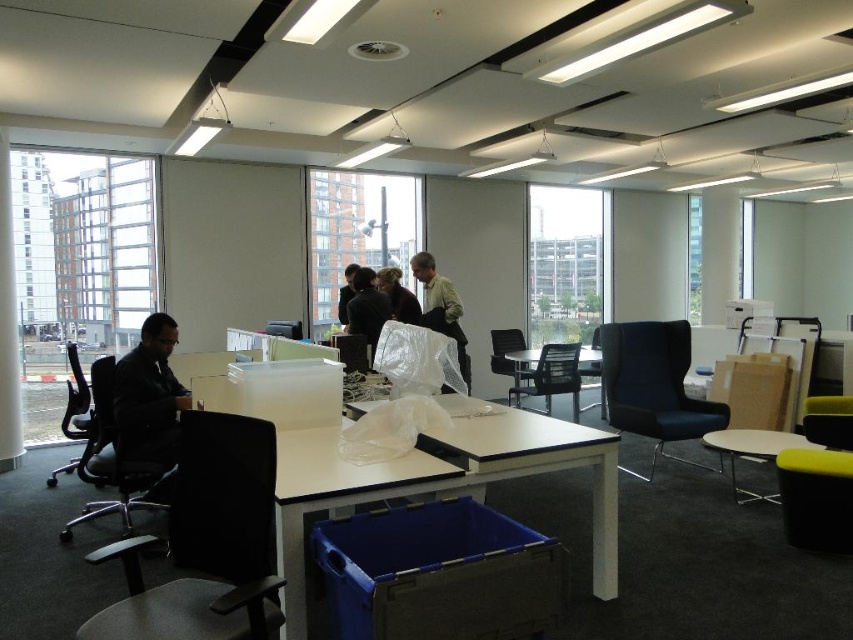
You are an office worker trying to find a chair to sit down. You see the black mesh office chair at left and the matte black chair at center. Which chair is closer to the floor?

The black mesh office chair at left is closer to the floor because it is positioned below the matte black chair at center.

You are an office worker who just entered the room and wants to hang your matte black jacket at left on a coat rack located at the center of the room. Based on the coordinates provided, will the jacket be closer to the left wall or the right wall?

The coordinates of the matte black jacket at left are at point (149, 401). Since the x coordinate is 0.628, which is closer to 1 than to 0, the jacket is closer to the right wall than the left wall.